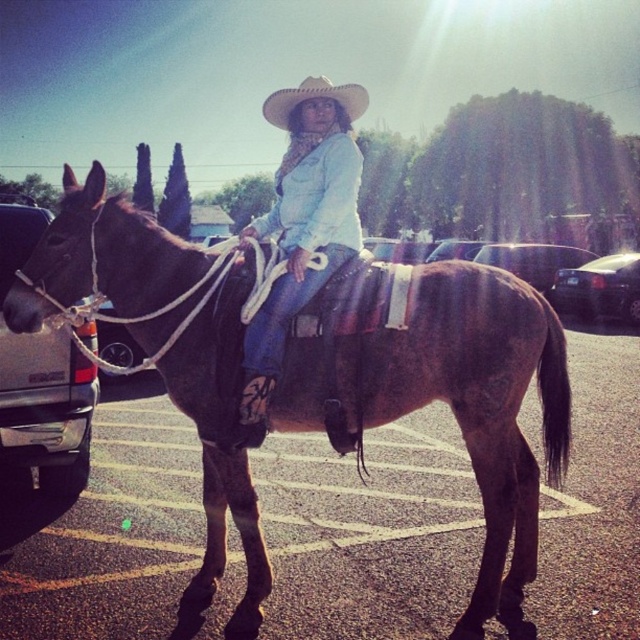
Question: Is denim jacket at center wider than brushed metal truck at left?

Choices:
 (A) yes
 (B) no

Answer: (B)

Question: Which of the following is the farthest from the observer?

Choices:
 (A) glossy black car at center
 (B) denim jacket at center
 (C) brown leather mule at center
 (D) black glossy sedan at right

Answer: (A)

Question: Which object is positioned closest to the brushed metal truck at left?

Choices:
 (A) denim jacket at center
 (B) glossy black car at center
 (C) black glossy sedan at right

Answer: (A)

Question: Does brushed metal truck at left appear on the left side of glossy black car at center?

Choices:
 (A) yes
 (B) no

Answer: (A)

Question: Is brown leather mule at center below glossy black car at center?

Choices:
 (A) no
 (B) yes

Answer: (B)

Question: Which object is closer to the camera taking this photo?

Choices:
 (A) brown leather mule at center
 (B) light beige straw cowboy hat at center
 (C) black glossy sedan at right

Answer: (A)